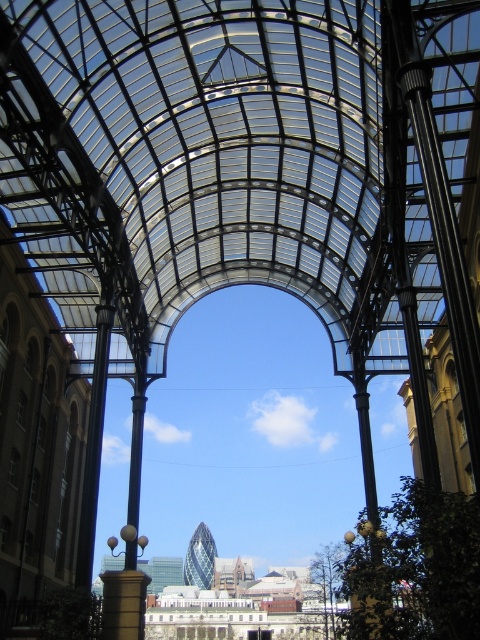
Question: Does transparent glass roof at center have a larger size compared to metallic pole at center?

Choices:
 (A) no
 (B) yes

Answer: (B)

Question: Where is transparent glass roof at center located in relation to metallic pole at center in the image?

Choices:
 (A) right
 (B) left

Answer: (A)

Question: Which point is closer to the camera?

Choices:
 (A) click(x=124, y=602)
 (B) click(x=338, y=163)

Answer: (A)

Question: Which point is closer to the camera taking this photo?

Choices:
 (A) (47, 180)
 (B) (112, 600)

Answer: (A)

Question: Is transparent glass roof at center thinner than metallic pole at center?

Choices:
 (A) yes
 (B) no

Answer: (B)